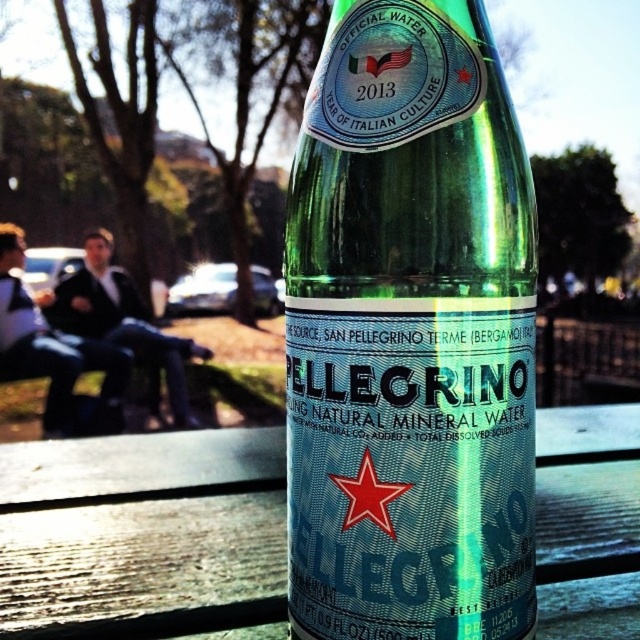
You are trying to reach for the green glass bottle at center while sitting on the wooden bench at center. Can you easily grab it without moving your body?

The green glass bottle at center is in front of wooden bench at center, so it is positioned where you can easily reach it while sitting on the bench without needing to move your body.

You are a photographer setting up a shot of the green glass bottle at center and the wooden bench at center. To ensure both are in frame, you need to know their positions. Which object is located to the right of the other?

The green glass bottle at center is positioned on the right side of wooden bench at center.

You are standing in front of the wooden bench where the green glass bottle at center is placed. If you want to place a small note exactly where the bottle is, what coordinates should you use?

You should place the small note at coordinates point [410,333] where the green glass bottle at center is located.